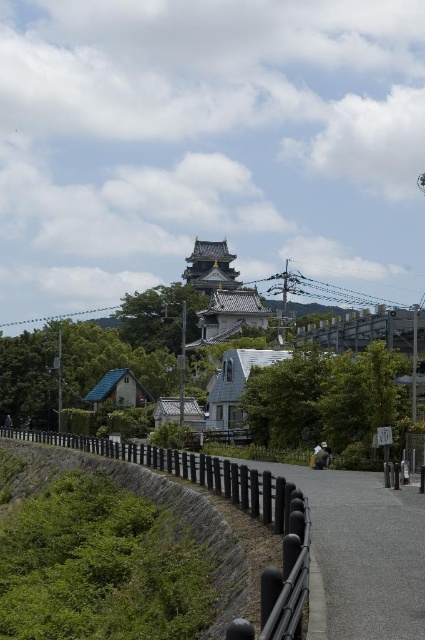
You are a tourist standing at the base of the hill looking up at the castle. You notice the black metal railing at lower center and the stone wall at lower center. Which object is physically closer to you as you stand at the starting point of the pathway?

The black metal railing at lower center is closer to the viewer than the stone wall at lower center, so the black metal railing at lower center is physically closer to you as you stand at the starting point of the pathway.

You are a tourist approaching the castle and notice the black metal railing at lower center and the stone wall at lower center. Which object is positioned to the right when viewed from your perspective?

The black metal railing at lower center is to the right of the stone wall at lower center, so the black metal railing at lower center is positioned to the right.